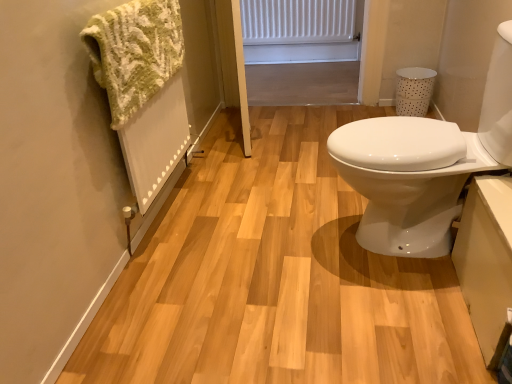
You are a GUI agent. You are given a task and a screenshot of the screen. Output one action in this format:
    pyautogui.click(x=<x>, y=<y>)
    Task: Click on the vacant space to the left of white glossy sink at right
    This screenshot has height=384, width=512.
    Given the screenshot: What is the action you would take?
    pyautogui.click(x=280, y=252)